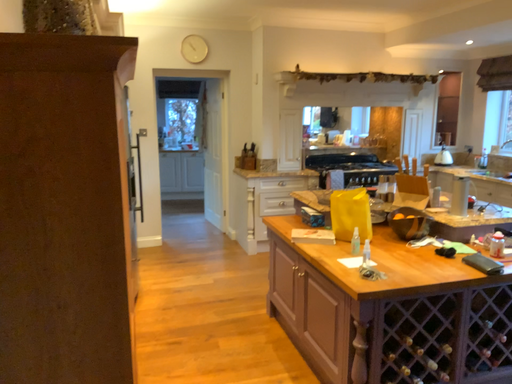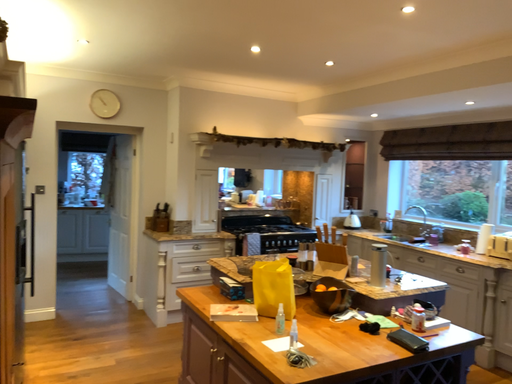
Question: Which way did the camera rotate in the video?

Choices:
 (A) rotated right
 (B) rotated left

Answer: (A)